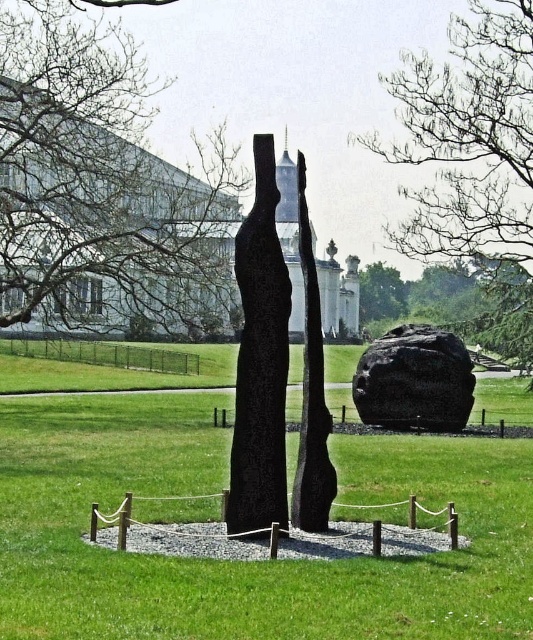
Is polished dark stone sculpture at center to the right of green leafy tree at center from the viewer's perspective?

No, polished dark stone sculpture at center is not to the right of green leafy tree at center.

The height and width of the screenshot is (640, 533). What are the coordinates of `polished dark stone sculpture at center` in the screenshot? It's located at (311, 394).

In order to click on polished dark stone sculpture at center in this screenshot , I will do `click(311, 394)`.

Can you confirm if smooth bark tree at center is smaller than polished dark stone sculpture at center?

Incorrect, smooth bark tree at center is not smaller in size than polished dark stone sculpture at center.

Who is higher up, smooth bark tree at center or polished dark stone sculpture at center?

smooth bark tree at center

Find the location of a particular element. This screenshot has height=640, width=533. smooth bark tree at center is located at coordinates (95, 177).

The height and width of the screenshot is (640, 533). What are the coordinates of `smooth bark tree at center` in the screenshot? It's located at (95, 177).

Is point (528, 276) closer to camera compared to point (462, 384)?

No, (528, 276) is behind (462, 384).

Which is more to the left, smooth dark brown rock at right or black polished rock at center?

From the viewer's perspective, black polished rock at center appears more on the left side.

Image resolution: width=533 pixels, height=640 pixels. What do you see at coordinates (472, 156) in the screenshot?
I see `smooth dark brown rock at right` at bounding box center [472, 156].

Locate an element on the screen. The width and height of the screenshot is (533, 640). smooth dark brown rock at right is located at coordinates (472, 156).